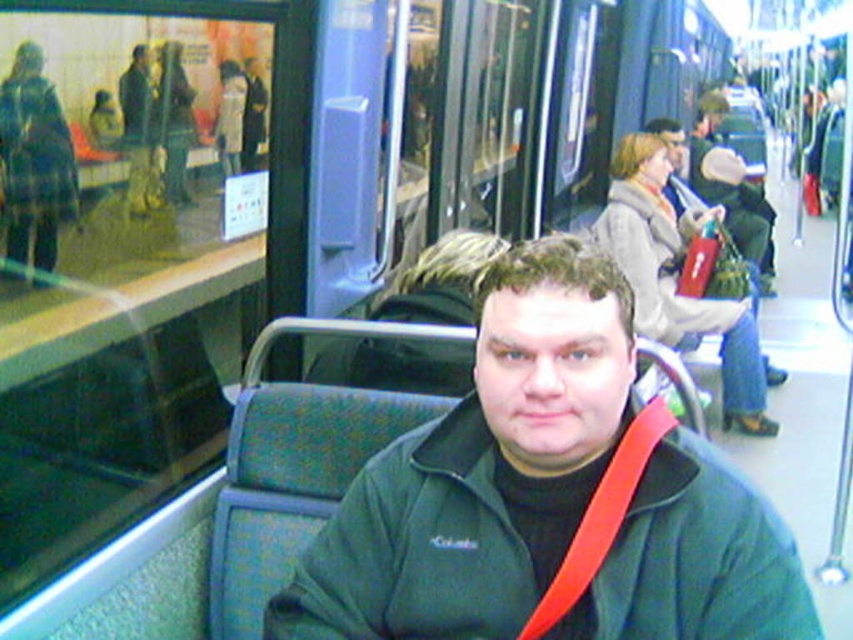
Question: Is green fleece jacket at center to the left of red fabric seatbelt at center from the viewer's perspective?

Choices:
 (A) no
 (B) yes

Answer: (B)

Question: Can you confirm if green fleece jacket at center is bigger than matte green jacket at center?

Choices:
 (A) yes
 (B) no

Answer: (B)

Question: Does green fleece jacket at center have a smaller size compared to red fabric seatbelt at center?

Choices:
 (A) no
 (B) yes

Answer: (A)

Question: Which point appears farthest from the camera in this image?

Choices:
 (A) (648, 131)
 (B) (511, 440)
 (C) (622, 433)

Answer: (A)

Question: Which object is positioned closest to the red fabric seatbelt at center?

Choices:
 (A) green fleece jacket at center
 (B) matte green jacket at center

Answer: (A)

Question: Which point is closer to the camera?

Choices:
 (A) red fabric seatbelt at center
 (B) matte green jacket at center

Answer: (A)